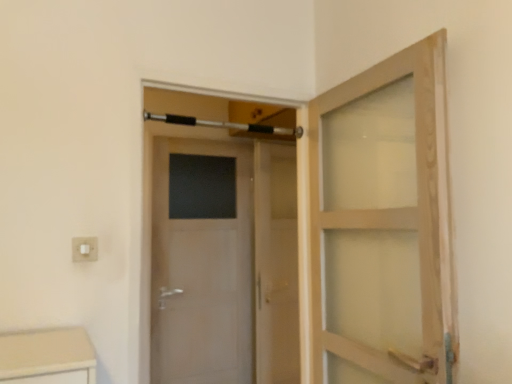
Describe the element at coordinates (225, 125) in the screenshot. I see `silver metallic towel bar at upper center` at that location.

The width and height of the screenshot is (512, 384). I want to click on white plastic electric outlet at lower left, so click(x=84, y=249).

Describe the element at coordinates (233, 260) in the screenshot. The width and height of the screenshot is (512, 384). I see `white glossy door at center` at that location.

What are the coordinates of `silver metallic towel bar at upper center` in the screenshot? It's located at (225, 125).

Does white glossy door at center have a larger size compared to white plastic electric outlet at lower left?

Correct, white glossy door at center is larger in size than white plastic electric outlet at lower left.

The height and width of the screenshot is (384, 512). In order to click on door on the right of white plastic electric outlet at lower left in this screenshot , I will do `click(233, 260)`.

Is white glossy door at center next to white plastic electric outlet at lower left and touching it?

No, white glossy door at center is not beside white plastic electric outlet at lower left.

Is clear glass screen door at center situated inside white plastic electric outlet at lower left or outside?

clear glass screen door at center cannot be found inside white plastic electric outlet at lower left.

Is point (287, 157) closer or farther from the camera than point (90, 244)?

Point (287, 157) is farther from the camera than point (90, 244).

Consider the image. Is clear glass screen door at center in front of white plastic electric outlet at lower left?

No, it is behind white plastic electric outlet at lower left.

Is silver metallic towel bar at upper center positioned before white plastic electric outlet at lower left?

No, it is behind white plastic electric outlet at lower left.

Considering the sizes of objects silver metallic towel bar at upper center and white plastic electric outlet at lower left in the image provided, who is thinner, silver metallic towel bar at upper center or white plastic electric outlet at lower left?

white plastic electric outlet at lower left.

From the image's perspective, which one is positioned higher, silver metallic towel bar at upper center or white plastic electric outlet at lower left?

silver metallic towel bar at upper center appears higher in the image.

Between white glossy door at center and silver metallic towel bar at upper center, which one has larger size?

white glossy door at center is bigger.

At what (x,y) coordinates should I click in order to perform the action: click on door below the silver metallic towel bar at upper center (from the image's perspective). Please return your answer as a coordinate pair (x, y). This screenshot has width=512, height=384. Looking at the image, I should click on (233, 260).

Would you say white glossy door at center is to the left or to the right of silver metallic towel bar at upper center in the picture?

Clearly, white glossy door at center is on the right of silver metallic towel bar at upper center in the image.

From a real-world perspective, between white glossy door at center and silver metallic towel bar at upper center, who is vertically higher?

silver metallic towel bar at upper center.

Which of these two, clear glass screen door at center or silver metallic towel bar at upper center, stands shorter?

With less height is silver metallic towel bar at upper center.

From a real-world perspective, relative to silver metallic towel bar at upper center, is clear glass screen door at center vertically above or below?

clear glass screen door at center is situated lower than silver metallic towel bar at upper center in the real world.

Is clear glass screen door at center directly adjacent to silver metallic towel bar at upper center?

There is a gap between clear glass screen door at center and silver metallic towel bar at upper center.

From the image's perspective, relative to silver metallic towel bar at upper center, is clear glass screen door at center above or below?

clear glass screen door at center is situated lower than silver metallic towel bar at upper center in the image.

Would you say white plastic electric outlet at lower left contains silver metallic towel bar at upper center?

Actually, silver metallic towel bar at upper center is outside white plastic electric outlet at lower left.

What's the angular difference between white plastic electric outlet at lower left and silver metallic towel bar at upper center's facing directions?

0.313 degrees separate the facing orientations of white plastic electric outlet at lower left and silver metallic towel bar at upper center.

Does white plastic electric outlet at lower left have a greater height compared to silver metallic towel bar at upper center?

Indeed, white plastic electric outlet at lower left has a greater height compared to silver metallic towel bar at upper center.

Considering the sizes of objects white plastic electric outlet at lower left and silver metallic towel bar at upper center in the image provided, who is smaller, white plastic electric outlet at lower left or silver metallic towel bar at upper center?

white plastic electric outlet at lower left is smaller.

Does white plastic electric outlet at lower left have a larger size compared to clear glass screen door at center?

Actually, white plastic electric outlet at lower left might be smaller than clear glass screen door at center.

Is point (94, 247) positioned before point (291, 162)?

Yes, it is.

Considering the sizes of objects white plastic electric outlet at lower left and clear glass screen door at center in the image provided, who is thinner, white plastic electric outlet at lower left or clear glass screen door at center?

Thinner between the two is white plastic electric outlet at lower left.

Where is `screen door below the white plastic electric outlet at lower left (from the image's perspective)`? The height and width of the screenshot is (384, 512). screen door below the white plastic electric outlet at lower left (from the image's perspective) is located at coordinates (276, 264).

In the image, there is a white glossy door at center. Where is `electric outlet above it (from the image's perspective)`? The width and height of the screenshot is (512, 384). electric outlet above it (from the image's perspective) is located at coordinates (84, 249).

Locate an element on the screen. This screenshot has height=384, width=512. screen door below the white plastic electric outlet at lower left (from a real-world perspective) is located at coordinates (276, 264).

From the picture: Which object lies further to the anchor point white glossy door at center, silver metallic towel bar at upper center or clear glass screen door at center?

Among the two, silver metallic towel bar at upper center is located further to white glossy door at center.

Which object lies further to the anchor point silver metallic towel bar at upper center, white glossy door at center or white plastic electric outlet at lower left?

Among the two, white plastic electric outlet at lower left is located further to silver metallic towel bar at upper center.

Estimate the real-world distances between objects in this image. Which object is closer to white plastic electric outlet at lower left, silver metallic towel bar at upper center or clear glass screen door at center?

Among the two, silver metallic towel bar at upper center is located nearer to white plastic electric outlet at lower left.

Looking at the image, which one is located closer to white plastic electric outlet at lower left, silver metallic towel bar at upper center or white glossy door at center?

silver metallic towel bar at upper center.

Looking at the image, which one is located further to silver metallic towel bar at upper center, white plastic electric outlet at lower left or clear glass screen door at center?

white plastic electric outlet at lower left is positioned further to the anchor silver metallic towel bar at upper center.

Considering their positions, is silver metallic towel bar at upper center positioned closer to clear glass screen door at center than white glossy door at center?

Among the two, white glossy door at center is located nearer to clear glass screen door at center.

When comparing their distances from white glossy door at center, does clear glass screen door at center or white plastic electric outlet at lower left seem further?

white plastic electric outlet at lower left lies further to white glossy door at center than the other object.

Based on their spatial positions, is clear glass screen door at center or white plastic electric outlet at lower left closer to silver metallic towel bar at upper center?

clear glass screen door at center is positioned closer to the anchor silver metallic towel bar at upper center.

What are the coordinates of `door between white plastic electric outlet at lower left and clear glass screen door at center along the z-axis` in the screenshot? It's located at (233, 260).

This screenshot has width=512, height=384. I want to click on electric outlet between silver metallic towel bar at upper center and white glossy door at center from top to bottom, so click(84, 249).

Identify the location of towel bar between white glossy door at center and clear glass screen door at center in the front-back direction. Image resolution: width=512 pixels, height=384 pixels. (225, 125).

I want to click on towel bar between white plastic electric outlet at lower left and clear glass screen door at center in the front-back direction, so click(x=225, y=125).